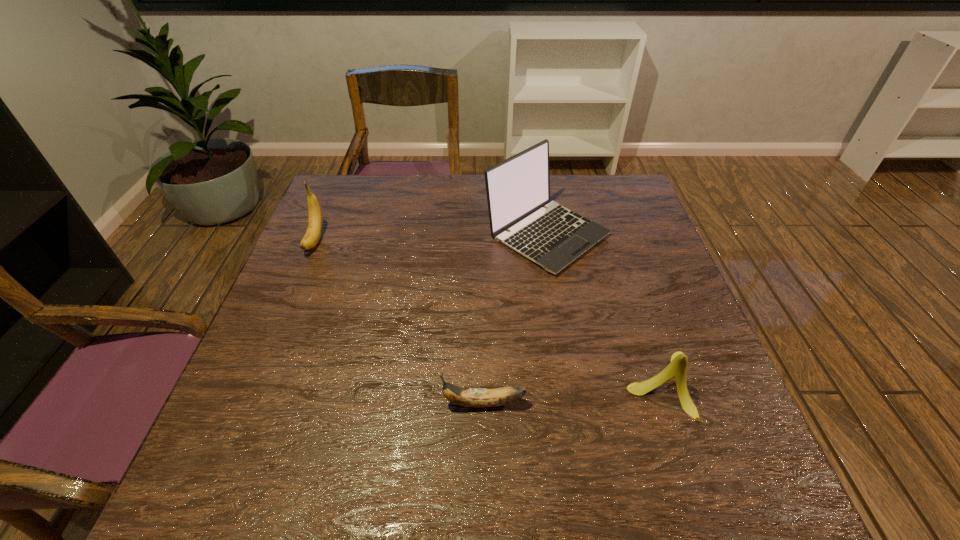
Image resolution: width=960 pixels, height=540 pixels. What are the coordinates of `vacant area that satisfies the following two spatial constraints: 1. at the start of the peel on the tallest banana; 2. on the right side of the rightmost banana` in the screenshot? It's located at (253, 385).